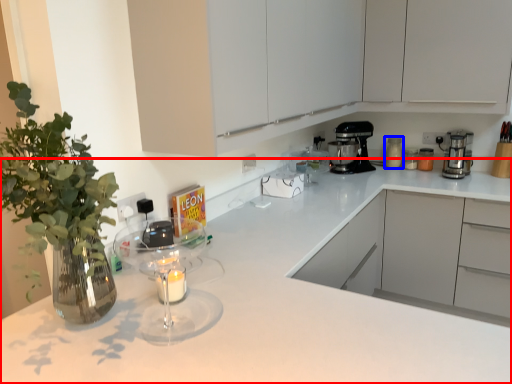
Question: Which object appears closest to the camera in this image, countertop (highlighted by a red box) or kitchen appliance (highlighted by a blue box)?

Choices:
 (A) countertop
 (B) kitchen appliance

Answer: (A)